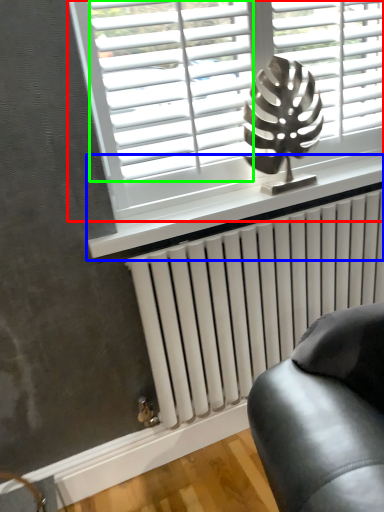
Question: Which is farther away from window (highlighted by a red box)? window sill (highlighted by a blue box) or blind (highlighted by a green box)?

Choices:
 (A) window sill
 (B) blind

Answer: (A)